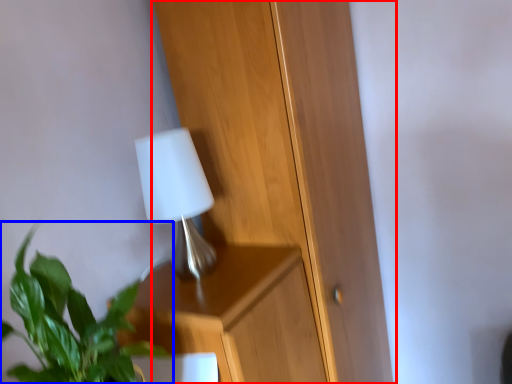
Question: Which of the following is the closest to the observer, dresser (highlighted by a red box) or houseplant (highlighted by a blue box)?

Choices:
 (A) dresser
 (B) houseplant

Answer: (B)